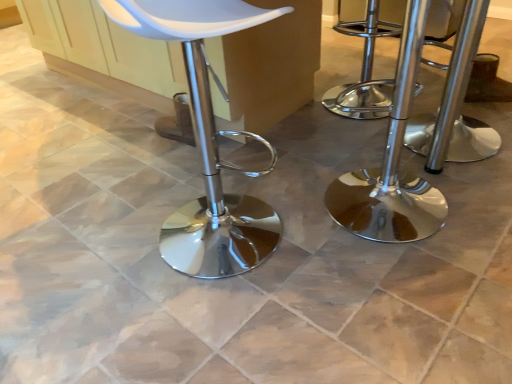
At what (x,y) coordinates should I click in order to perform the action: click on vacant area that is in front of polished chrome stool at center, which is the 2th stool from left to right. Please return your answer as a coordinate pair (x, y). Looking at the image, I should click on (473, 182).